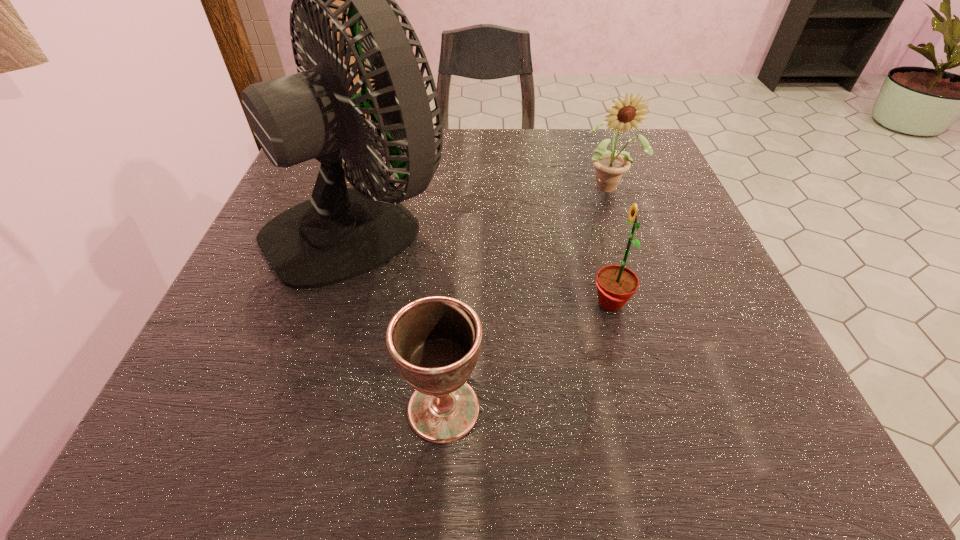
Locate an element on the screen. vacant space that is in between the nearer sunflower and the fan is located at coordinates (485, 262).

Locate an element on the screen. Image resolution: width=960 pixels, height=540 pixels. free spot between the nearer sunflower and the farther sunflower is located at coordinates (610, 245).

Identify the location of free space between the nearest object and the farther sunflower. The image size is (960, 540). (526, 298).

Where is `object that is the nearest to the shortest object`? object that is the nearest to the shortest object is located at coordinates 340,233.

I want to click on object that is the third nearest to the shortest object, so click(x=609, y=166).

Find the location of a particular element. The image size is (960, 540). vacant position in the image that satisfies the following two spatial constraints: 1. in front of the tallest object to direct airflow; 2. on the right side of the chalice is located at coordinates (304, 409).

Where is `free location that satisfies the following two spatial constraints: 1. on the front-facing side of the farther sunflower; 2. in front of the fan to direct airflow`? The height and width of the screenshot is (540, 960). free location that satisfies the following two spatial constraints: 1. on the front-facing side of the farther sunflower; 2. in front of the fan to direct airflow is located at coordinates (622, 222).

Where is `vacant space that satisfies the following two spatial constraints: 1. on the face of the nearer sunflower; 2. on the front side of the chalice`? vacant space that satisfies the following two spatial constraints: 1. on the face of the nearer sunflower; 2. on the front side of the chalice is located at coordinates (638, 409).

What are the coordinates of `vacant space that satisfies the following two spatial constraints: 1. in front of the fan to direct airflow; 2. on the left side of the nearest object` in the screenshot? It's located at (304, 409).

Identify the location of vacant space that satisfies the following two spatial constraints: 1. on the back side of the chalice; 2. in front of the tallest object to direct airflow. The image size is (960, 540). (455, 222).